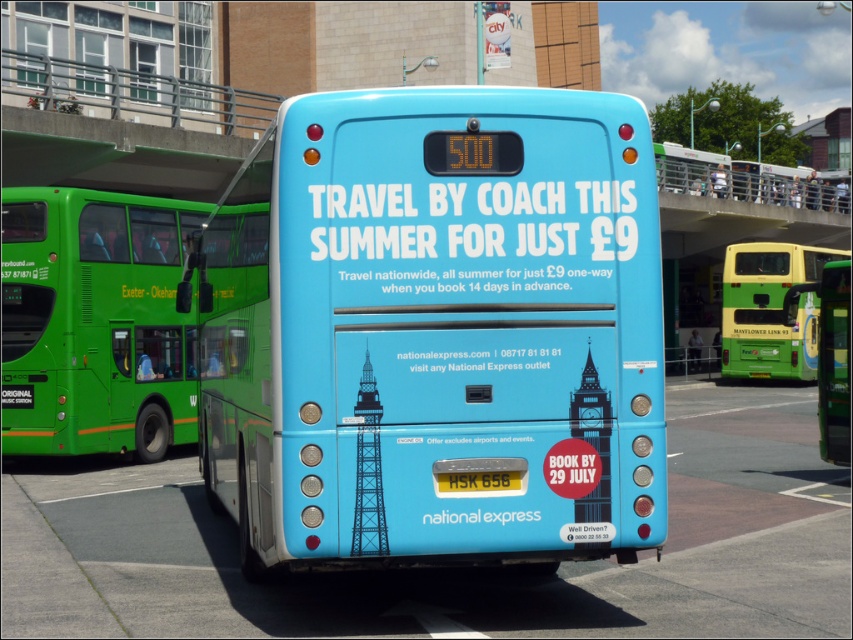
Question: Is green matte bus at left positioned at the back of yellow metallic license plate at center?

Choices:
 (A) yes
 (B) no

Answer: (A)

Question: Which point appears closest to the camera in this image?

Choices:
 (A) (805, 372)
 (B) (505, 488)
 (C) (128, 275)

Answer: (B)

Question: Where is matte blue bus at center located in relation to yellow-green plastic bus at right in the image?

Choices:
 (A) right
 (B) left

Answer: (B)

Question: Which object appears farthest from the camera in this image?

Choices:
 (A) yellow metallic license plate at center
 (B) yellow-green plastic bus at right

Answer: (B)

Question: Which point is farther to the camera?

Choices:
 (A) matte blue bus at center
 (B) green matte bus at left

Answer: (B)

Question: Does matte blue bus at center have a greater width compared to green matte bus at left?

Choices:
 (A) yes
 (B) no

Answer: (A)